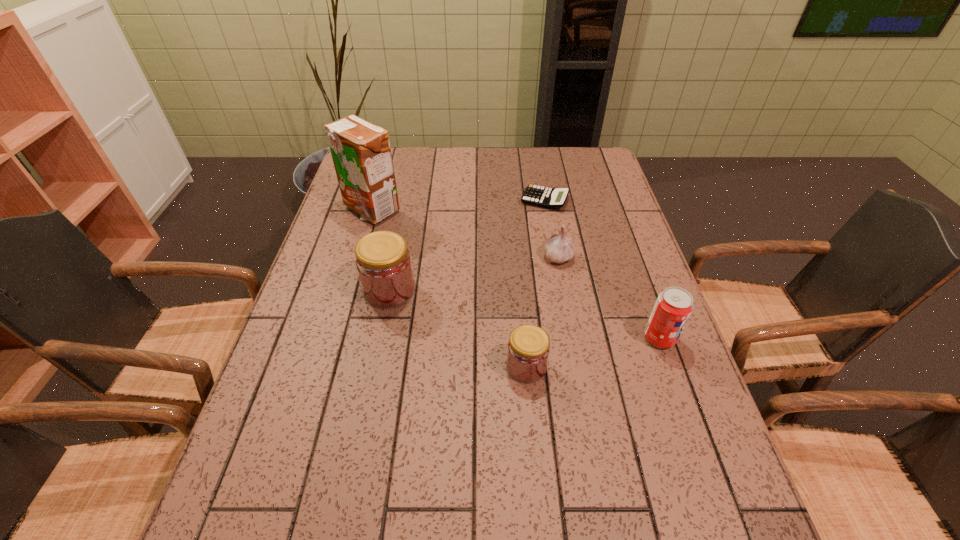
Where is `the fourth farthest object`? the fourth farthest object is located at coordinates (383, 262).

The image size is (960, 540). Identify the location of the farther jam. (383, 262).

I want to click on the nearer jam, so click(528, 349).

Find the location of `the right jam`. the right jam is located at coordinates (528, 349).

Locate an element on the screen. the fourth nearest object is located at coordinates (558, 248).

This screenshot has width=960, height=540. Identify the location of the shortest object. (552, 198).

The height and width of the screenshot is (540, 960). I want to click on carton, so click(361, 153).

What are the coordinates of `soda can` in the screenshot? It's located at coord(673,307).

You are a GUI agent. You are given a task and a screenshot of the screen. Output one action in this format:
    pyautogui.click(x=<x>, y=<y>)
    Task: Click on the vacant space situated on the left of the farther jam
    The width and height of the screenshot is (960, 540).
    Given the screenshot: What is the action you would take?
    pyautogui.click(x=336, y=290)

What are the coordinates of `free location located on the back of the right jam` in the screenshot? It's located at (522, 319).